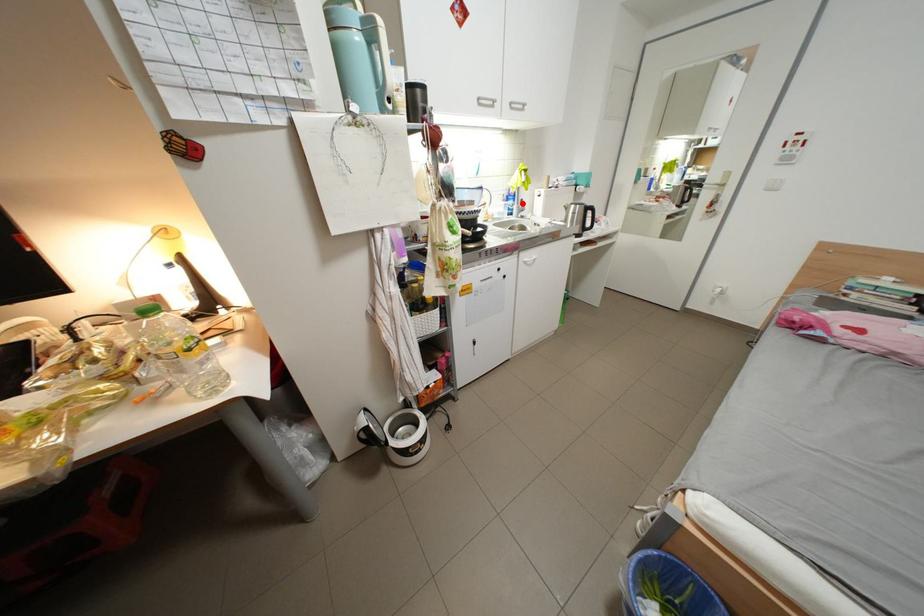
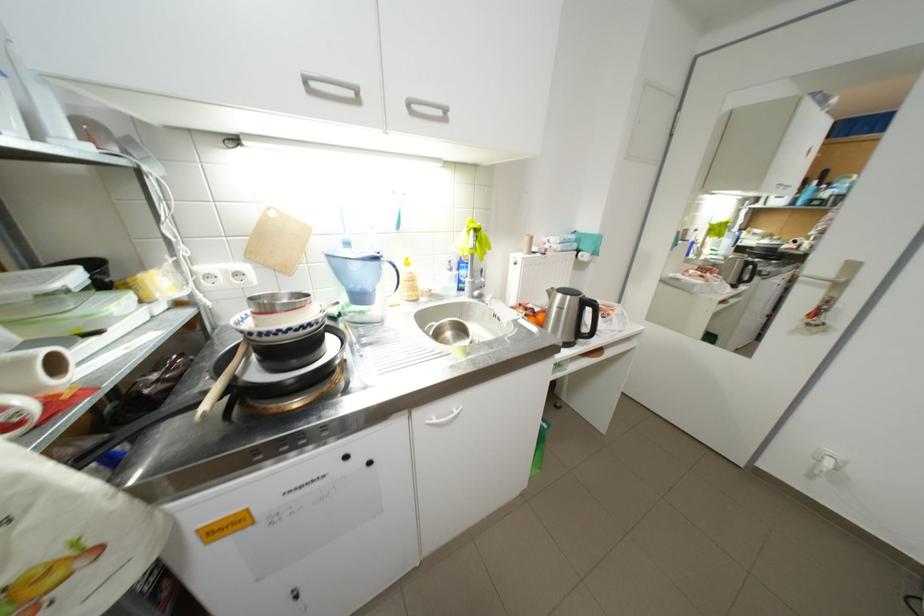
The point at the highlighted location is marked in the first image. Where is the corresponding point in the second image?

(475, 273)